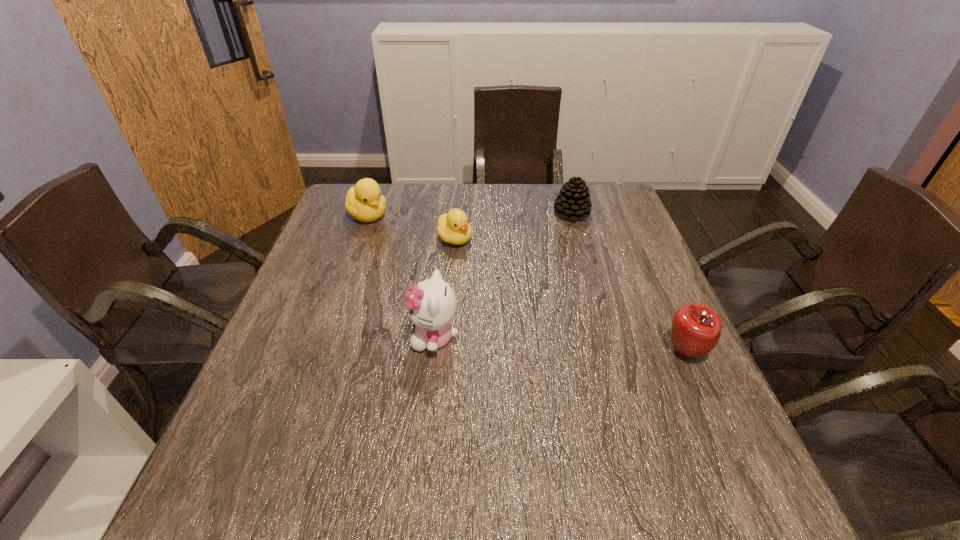
Where is `vacant space on the desktop that is between the tallest object and the apple and is positioned on the front-facing side of the leftmost object`? The image size is (960, 540). vacant space on the desktop that is between the tallest object and the apple and is positioned on the front-facing side of the leftmost object is located at coordinates click(539, 343).

Locate an element on the screen. vacant spot on the desktop that is between the tallest object and the apple and is positioned at the narrow end of the pinecone is located at coordinates (595, 346).

This screenshot has width=960, height=540. I want to click on vacant space on the desktop that is between the tallest object and the apple and is positioned on the beak of the third farthest object, so click(578, 346).